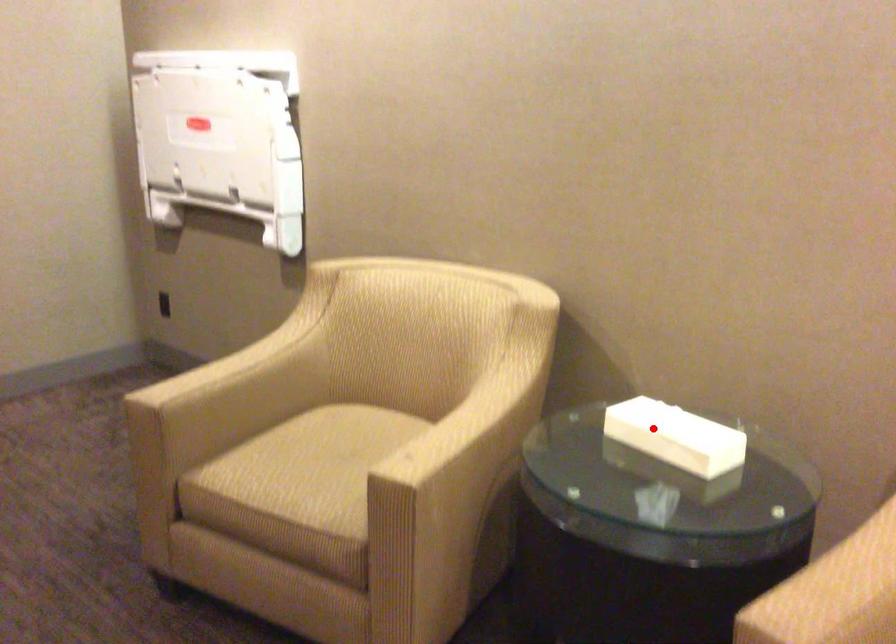
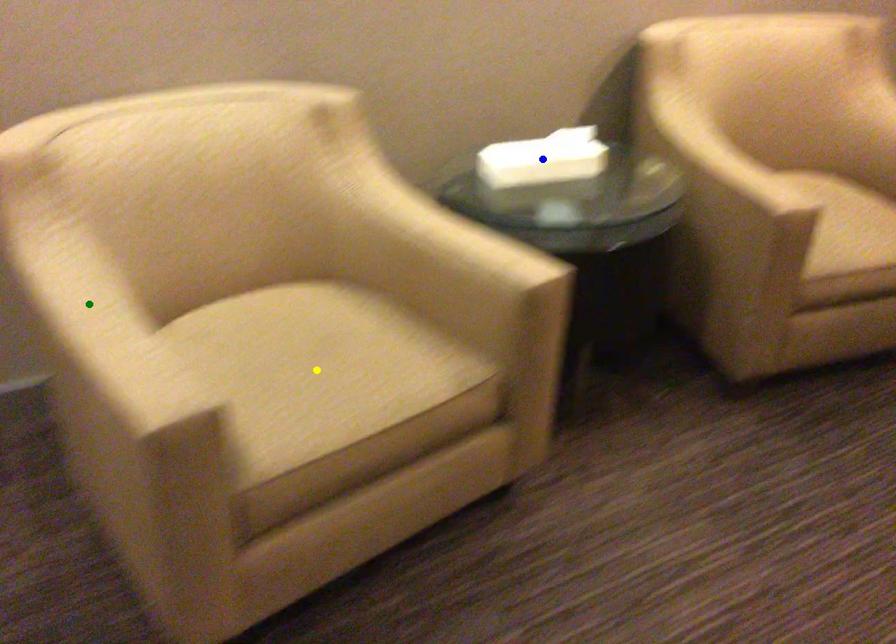
Question: I am providing you with two images of the same scene from different viewpoints. A red point is marked on the first image. You are given multiple points on the second image. Which mark in image 2 goes with the point in image 1?

Choices:
 (A) green point
 (B) blue point
 (C) yellow point

Answer: (B)